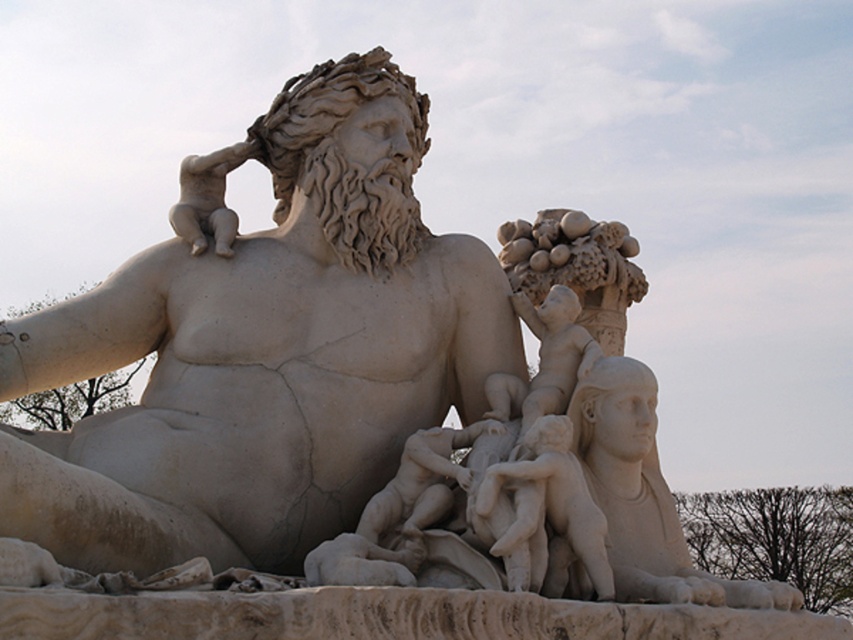
You are an art conservator examining the classical marble sculpture. You notice a specific point at coordinates point (263, 353). Which part of the sculpture does this point most likely correspond to?

The point (263, 353) corresponds to the white marble statue at center.

Based on the photo, you are an art student standing in front of the classical marble sculpture. You notice the white marble statue at center and the smooth white cherub at center. From your perspective, which object is positioned to the left?

The white marble statue at center is to the left of the smooth white cherub at center, so the white marble statue at center is positioned to the left.

Looking at this image, you are standing in front of the classical marble sculpture. Where is the white marble statue at center located in terms of its 2D coordinates?

The white marble statue at center is located at the 2D coordinates of point [263,353].